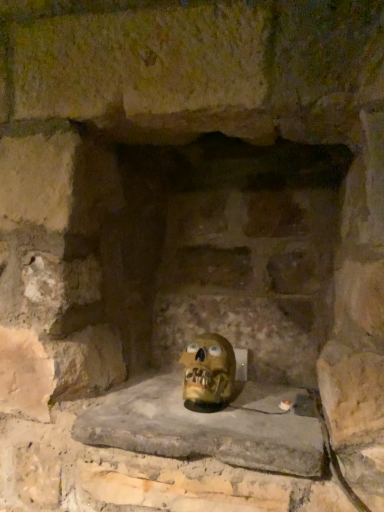
What do you see at coordinates (208, 371) in the screenshot? I see `matte yellow skull at center` at bounding box center [208, 371].

Measure the distance between matte yellow skull at center and camera.

matte yellow skull at center is 86.42 centimeters away from camera.

The width and height of the screenshot is (384, 512). Find the location of `matte yellow skull at center`. matte yellow skull at center is located at coordinates (208, 371).

Looking at this image, measure the distance between point (x=212, y=419) and camera.

A distance of 32.99 inches exists between point (x=212, y=419) and camera.

The image size is (384, 512). What do you see at coordinates (210, 426) in the screenshot?
I see `smooth stone window sill at center` at bounding box center [210, 426].

What is the approximate width of smooth stone window sill at center?

17.27 inches.

Locate an element on the screen. This screenshot has width=384, height=512. smooth stone window sill at center is located at coordinates (210, 426).

I want to click on matte yellow skull at center, so click(208, 371).

Is matte yellow skull at center to the right of smooth stone window sill at center from the viewer's perspective?

Correct, you'll find matte yellow skull at center to the right of smooth stone window sill at center.

Who is more distant, matte yellow skull at center or smooth stone window sill at center?

matte yellow skull at center.

Is point (184, 384) closer to camera compared to point (319, 437)?

No, (184, 384) is further to viewer.

From the image's perspective, is matte yellow skull at center beneath smooth stone window sill at center?

No, from the image's perspective, matte yellow skull at center is not beneath smooth stone window sill at center.

From a real-world perspective, which object stands above the other?

From a 3D spatial view, matte yellow skull at center is above.

Considering the relative sizes of matte yellow skull at center and smooth stone window sill at center in the image provided, is matte yellow skull at center thinner than smooth stone window sill at center?

Correct, the width of matte yellow skull at center is less than that of smooth stone window sill at center.

Looking at this image, between matte yellow skull at center and smooth stone window sill at center, which one has more height?

Standing taller between the two is matte yellow skull at center.

Is matte yellow skull at center bigger than smooth stone window sill at center?

No, matte yellow skull at center is not bigger than smooth stone window sill at center.

Could smooth stone window sill at center be considered to be inside matte yellow skull at center?

No, smooth stone window sill at center is not inside matte yellow skull at center.

Is matte yellow skull at center not near smooth stone window sill at center?

No, matte yellow skull at center is in close proximity to smooth stone window sill at center.

Does matte yellow skull at center turn towards smooth stone window sill at center?

No, matte yellow skull at center is not turned towards smooth stone window sill at center.

This screenshot has height=512, width=384. In order to click on skull that is behind the smooth stone window sill at center in this screenshot , I will do `click(208, 371)`.

Which is more to the left, smooth stone window sill at center or matte yellow skull at center?

From the viewer's perspective, smooth stone window sill at center appears more on the left side.

Consider the image. Considering their positions, is smooth stone window sill at center located in front of or behind matte yellow skull at center?

Visually, smooth stone window sill at center is located in front of matte yellow skull at center.

Does point (121, 393) lie in front of point (207, 406)?

No, (121, 393) is behind (207, 406).

From the image's perspective, would you say smooth stone window sill at center is shown under matte yellow skull at center?

Correct, smooth stone window sill at center appears lower than matte yellow skull at center in the image.

From a real-world perspective, is smooth stone window sill at center located beneath matte yellow skull at center?

Yes.

Which of these two, smooth stone window sill at center or matte yellow skull at center, is wider?

Wider between the two is smooth stone window sill at center.

Between smooth stone window sill at center and matte yellow skull at center, which one has less height?

smooth stone window sill at center is shorter.

Considering the sizes of smooth stone window sill at center and matte yellow skull at center in the image, is smooth stone window sill at center bigger or smaller than matte yellow skull at center?

Clearly, smooth stone window sill at center is larger in size than matte yellow skull at center.

Is smooth stone window sill at center completely or partially outside of matte yellow skull at center?

smooth stone window sill at center lies outside matte yellow skull at center's area.

Would you consider smooth stone window sill at center to be distant from matte yellow skull at center?

No, there isn't a large distance between smooth stone window sill at center and matte yellow skull at center.

Looking at this image, is smooth stone window sill at center aimed at matte yellow skull at center?

No, smooth stone window sill at center does not turn towards matte yellow skull at center.

The height and width of the screenshot is (512, 384). I want to click on skull on the right of the smooth stone window sill at center, so click(x=208, y=371).

Locate an element on the screen. The width and height of the screenshot is (384, 512). window sill below the matte yellow skull at center (from a real-world perspective) is located at coordinates (210, 426).

The image size is (384, 512). Find the location of `window sill lying on the left of matte yellow skull at center`. window sill lying on the left of matte yellow skull at center is located at coordinates (210, 426).